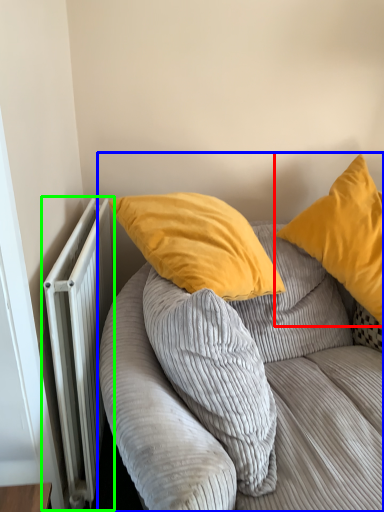
Question: Estimate the real-world distances between objects in this image. Which object is farther from pillow (highlighted by a red box), studio couch (highlighted by a blue box) or radiator (highlighted by a green box)?

Choices:
 (A) studio couch
 (B) radiator

Answer: (B)